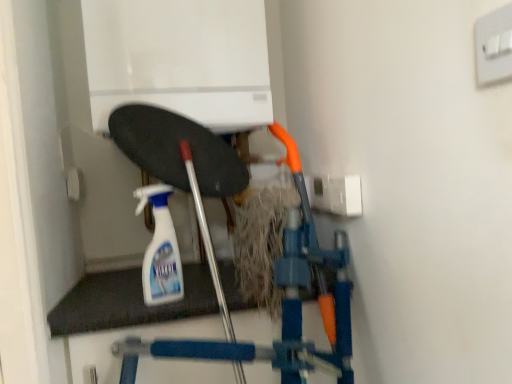
I want to click on vacant space that is to the left of clear plastic spray bottle at center, so click(x=109, y=300).